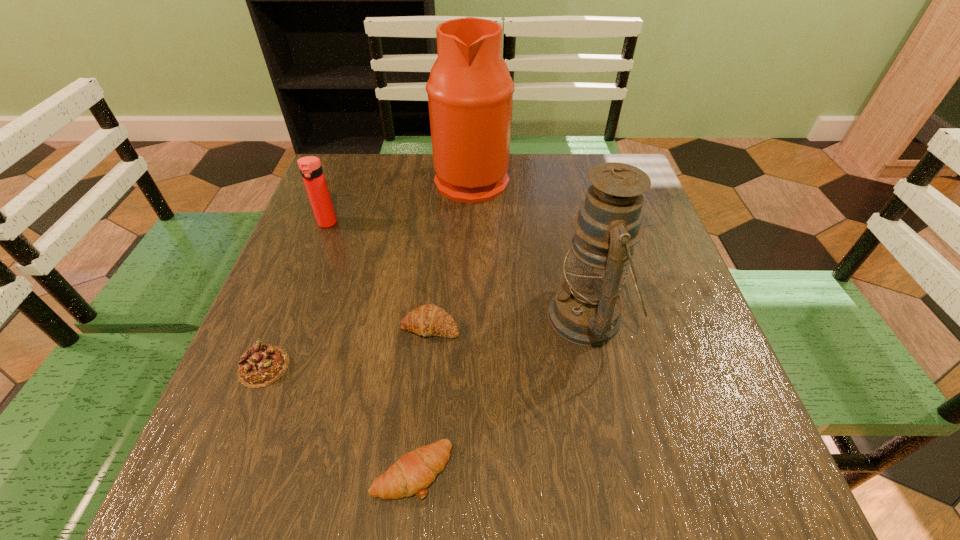
Where is `water jug`? Image resolution: width=960 pixels, height=540 pixels. water jug is located at coordinates (470, 91).

At what (x,y) coordinates should I click in order to perform the action: click on the rightmost object. Please return your answer as a coordinate pair (x, y). The height and width of the screenshot is (540, 960). Looking at the image, I should click on (586, 310).

Locate an element on the screen. Image resolution: width=960 pixels, height=540 pixels. the fifth shortest object is located at coordinates (586, 310).

Where is `the third tallest object`? the third tallest object is located at coordinates (310, 167).

Image resolution: width=960 pixels, height=540 pixels. What are the coordinates of `thermos bottle` in the screenshot? It's located at (310, 167).

At what (x,y) coordinates should I click in order to perform the action: click on the farther crescent roll. Please return your answer as a coordinate pair (x, y). The width and height of the screenshot is (960, 540). Looking at the image, I should click on (429, 320).

This screenshot has height=540, width=960. I want to click on chocolate cake, so click(261, 365).

The image size is (960, 540). What are the coordinates of `the nearer crescent roll` in the screenshot? It's located at (413, 472).

In order to click on vacant area situated 0.090m from the spout of the farthest object in this screenshot , I will do `click(541, 178)`.

This screenshot has width=960, height=540. What are the coordinates of `vacant region located 0.210m on the front of the oil lamp` in the screenshot? It's located at (625, 484).